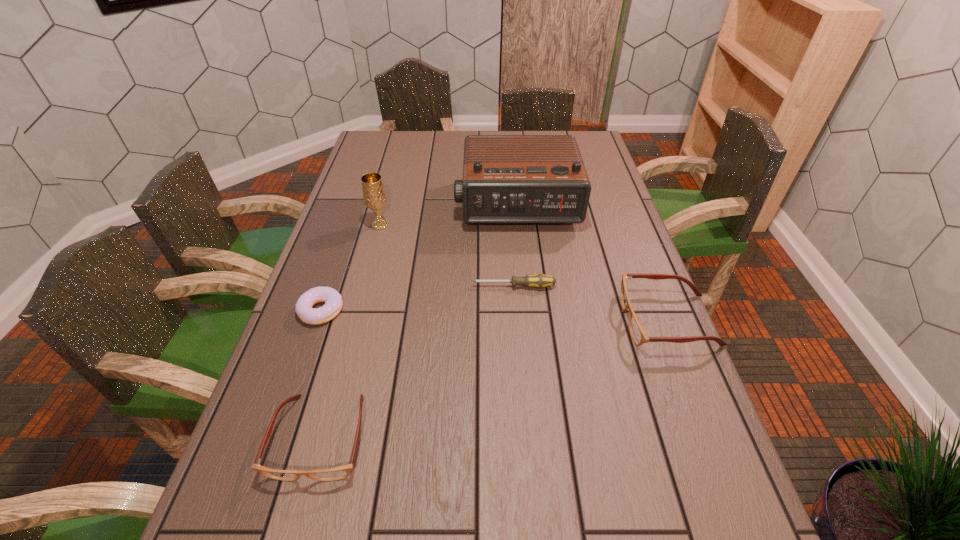
Please point a spot to place another spectacles for symmetrical spacing. Please provide its 2D coordinates. Your answer should be formatted as a tuple, i.e. [(x, y)], where the tuple contains the x and y coordinates of a point satisfying the conditions above.

[(514, 372)]